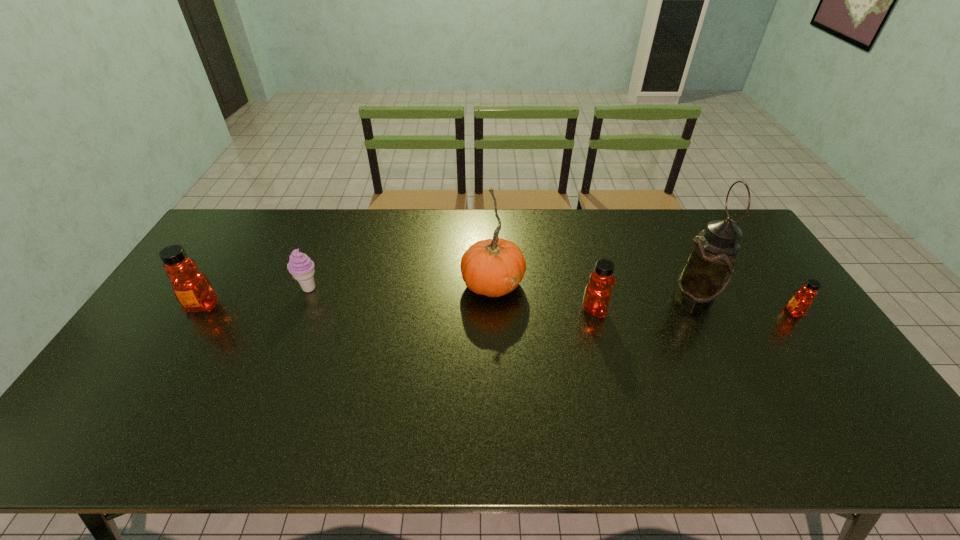
At what (x,y) coordinates should I click in order to perform the action: click on spot to insert another honey for uniform distribution. Please return your answer as a coordinate pair (x, y). Looking at the image, I should click on (397, 308).